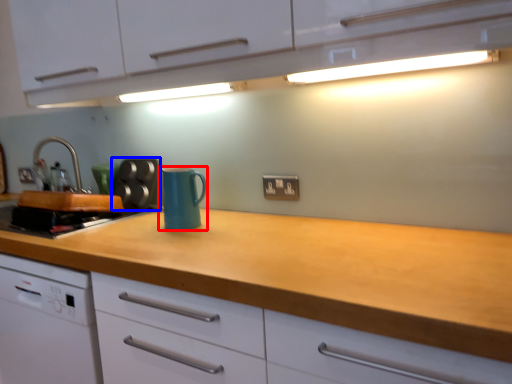
Question: Which of the following is the closest to the observer, kitchen appliance (highlighted by a red box) or appliance (highlighted by a blue box)?

Choices:
 (A) kitchen appliance
 (B) appliance

Answer: (A)